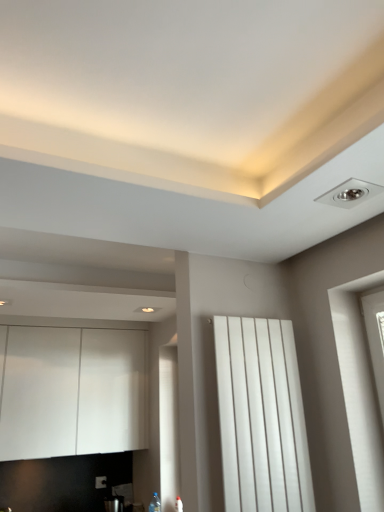
Question: From the image's perspective, does white matte cabinet at left appear higher than white matte radiator at center?

Choices:
 (A) yes
 (B) no

Answer: (B)

Question: From a real-world perspective, is white matte cabinet at left physically above white matte radiator at center?

Choices:
 (A) no
 (B) yes

Answer: (B)

Question: Is white matte cabinet at left wider than white matte radiator at center?

Choices:
 (A) no
 (B) yes

Answer: (B)

Question: From a real-world perspective, is white matte cabinet at left physically below white matte radiator at center?

Choices:
 (A) yes
 (B) no

Answer: (B)

Question: Is white matte cabinet at left positioned behind white matte radiator at center?

Choices:
 (A) yes
 (B) no

Answer: (A)

Question: From the image's perspective, would you say white matte cabinet at left is shown under white matte radiator at center?

Choices:
 (A) yes
 (B) no

Answer: (A)

Question: Is white matte radiator at center located outside white matte cabinet at left?

Choices:
 (A) yes
 (B) no

Answer: (A)

Question: Can you confirm if white matte radiator at center is smaller than white matte cabinet at left?

Choices:
 (A) no
 (B) yes

Answer: (B)

Question: Is white matte radiator at center aimed at white matte cabinet at left?

Choices:
 (A) yes
 (B) no

Answer: (B)

Question: Can you confirm if white matte radiator at center is thinner than white matte cabinet at left?

Choices:
 (A) no
 (B) yes

Answer: (B)

Question: From a real-world perspective, does white matte radiator at center sit lower than white matte cabinet at left?

Choices:
 (A) no
 (B) yes

Answer: (B)

Question: From the image's perspective, is white matte radiator at center beneath white matte cabinet at left?

Choices:
 (A) yes
 (B) no

Answer: (B)

Question: Considering the positions of white matte radiator at center and white matte cabinet at left in the image, is white matte radiator at center taller or shorter than white matte cabinet at left?

Choices:
 (A) tall
 (B) short

Answer: (B)